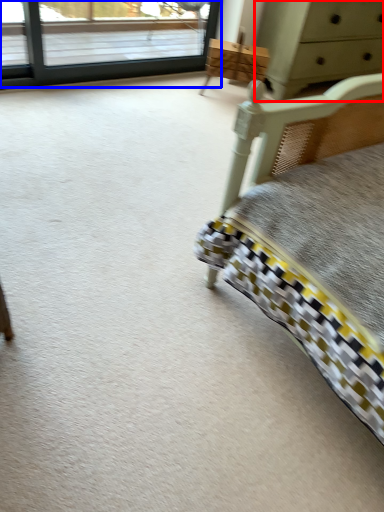
Question: Which of the following is the farthest to the observer, chest of drawers (highlighted by a red box) or window (highlighted by a blue box)?

Choices:
 (A) chest of drawers
 (B) window

Answer: (A)